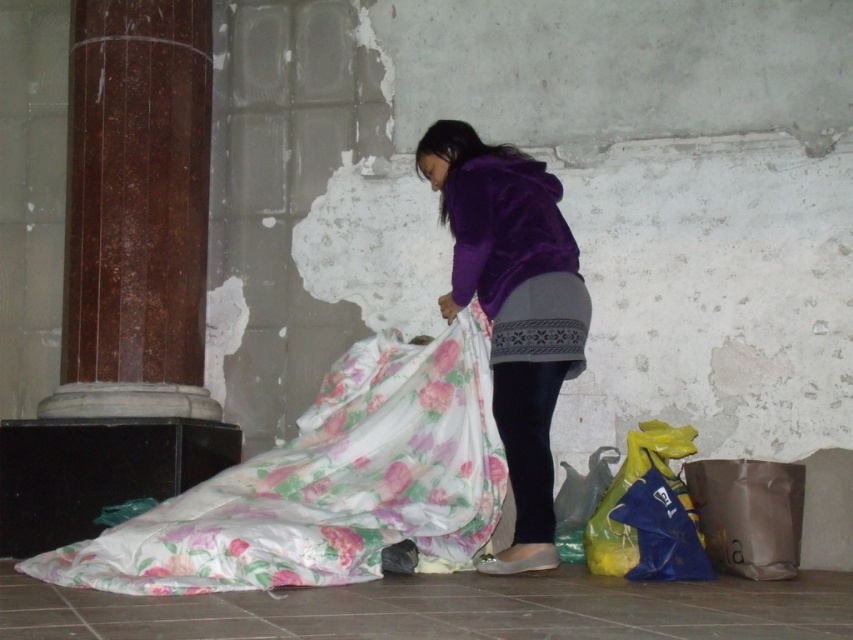
You are a delivery person who needs to place a small box between the floral satin blanket at lower left and the matte brown paper bag at lower right. Can you easily access the space between them?

The floral satin blanket at lower left is in front of the matte brown paper bag at lower right, so the space between them may be limited. However, since the blanket is at lower left and the bag is at lower right, you might still have enough space to place the small box between them depending on their exact positions.

You are standing in the unfinished building and see the floral satin blanket at lower left and the matte green plastic bag at lower right. Which object is positioned higher from the ground?

The floral satin blanket at lower left is located above the matte green plastic bag at lower right, so it is positioned higher from the ground.